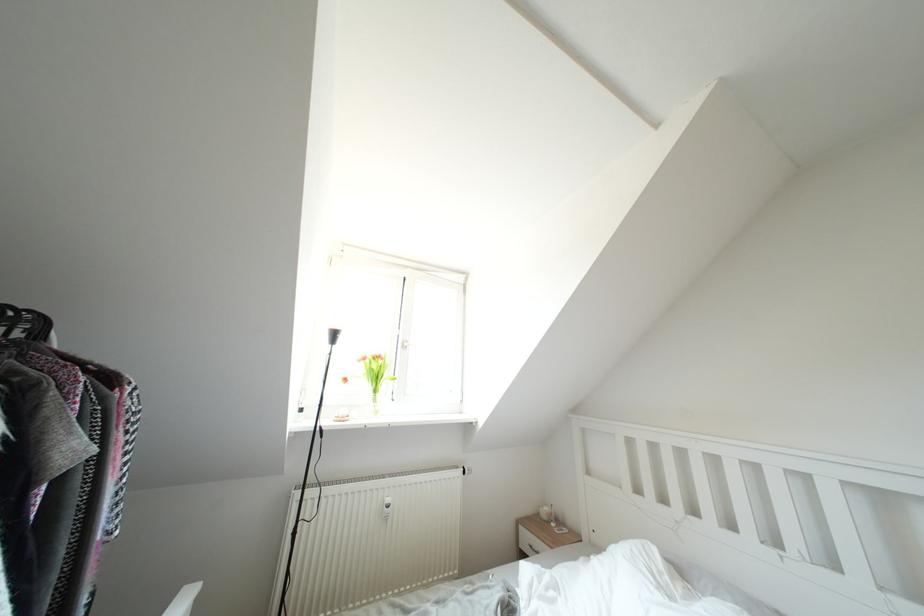
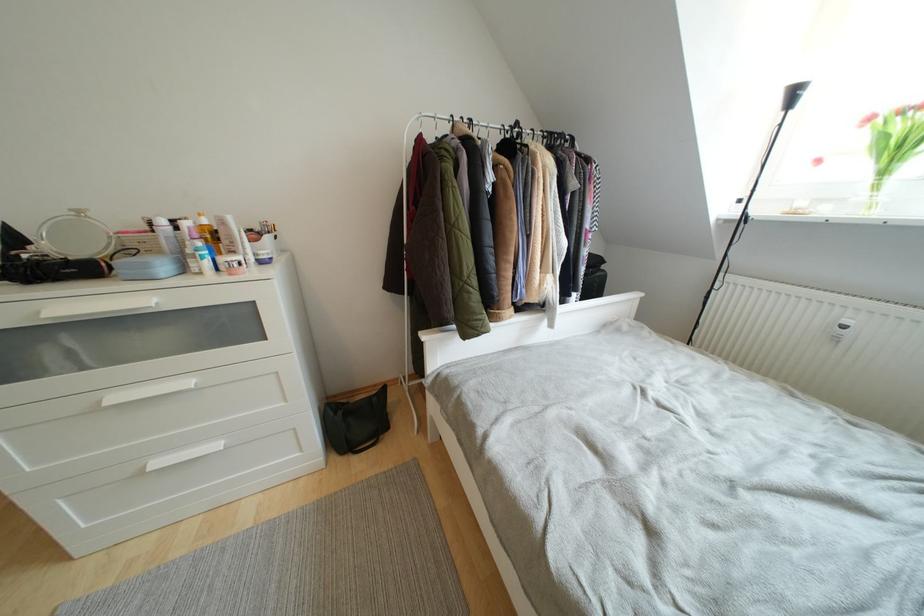
Find the pixel in the second image that matches point 393,504 in the first image.

(853, 326)